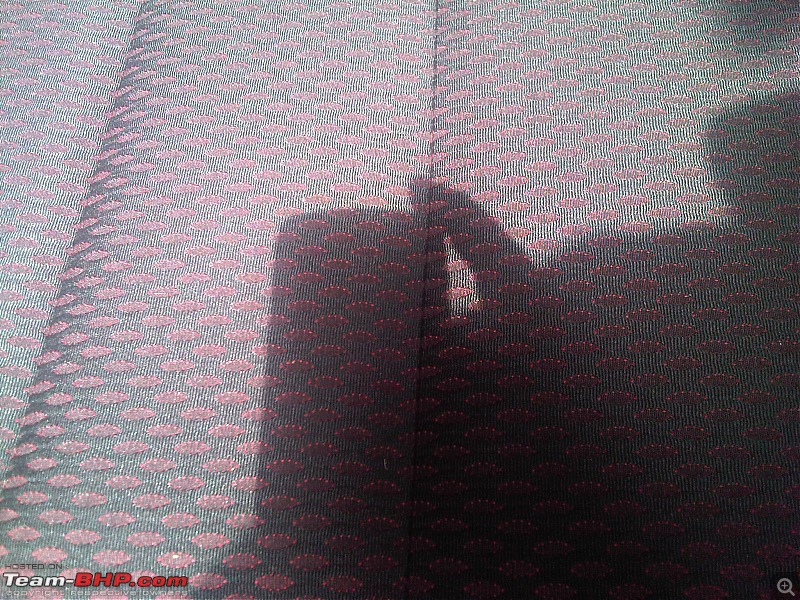
Find the location of `fabric`. fabric is located at coordinates (660, 178).